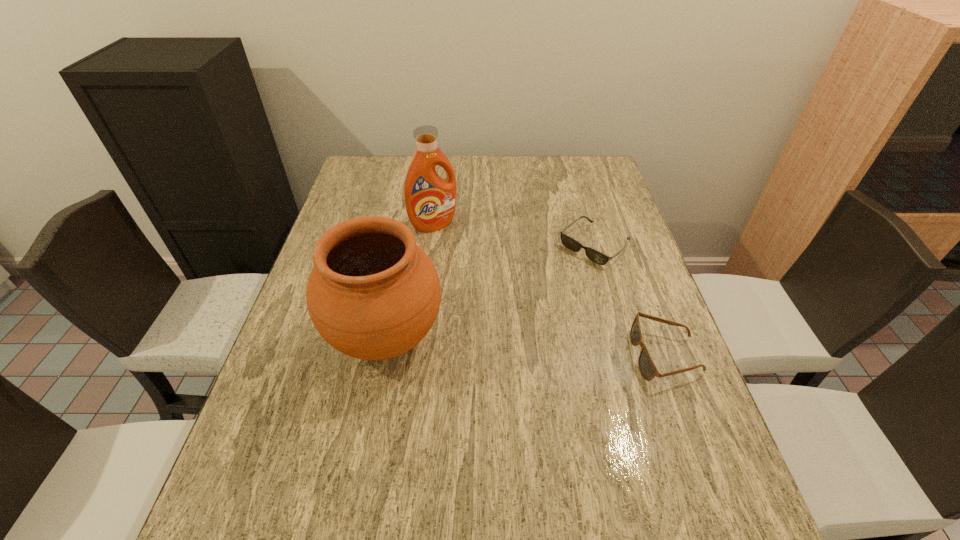
Where is `pottery`? pottery is located at coordinates (373, 294).

In order to click on the nearer sunglasses in this screenshot , I will do `click(648, 370)`.

Identify the location of the third tallest object. (648, 370).

Locate an element on the screen. This screenshot has width=960, height=540. detergent is located at coordinates (430, 201).

Locate an element on the screen. This screenshot has width=960, height=540. the shortest object is located at coordinates (570, 243).

Locate an element on the screen. This screenshot has width=960, height=540. the farther sunglasses is located at coordinates (570, 243).

What are the coordinates of `vacant space situated 0.200m on the back of the pottery` in the screenshot? It's located at (403, 245).

Find the location of a particular element. Image resolution: width=960 pixels, height=540 pixels. vacant space located on the frames of the nearer sunglasses is located at coordinates (460, 355).

The width and height of the screenshot is (960, 540). In order to click on vacant space located on the frames of the nearer sunglasses in this screenshot , I will do pos(482,355).

The height and width of the screenshot is (540, 960). Identify the location of free space located 0.340m on the frames of the nearer sunglasses. (482, 355).